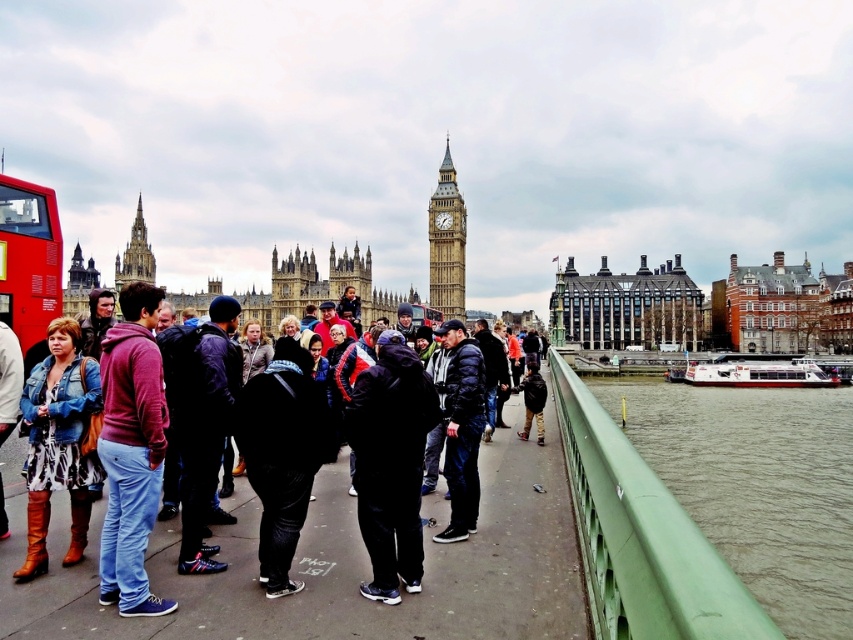
You are standing on Westminster Bridge and want to take a photo of both the point at coordinates point (769,532) and point (6,189). Which point should you focus on first to ensure both are in focus?

You should focus on point (769,532) first because it is closer to the camera than point (6,189), ensuring both points are within the depth of field.

You are standing on Westminster Bridge and want to take a photo of the green rubber railing at lower right. According to the scene description, where should you position yourself to ensure the railing is in the lower right corner of your photo?

The green rubber railing at lower right is located at point (757, 484), so you should position yourself to capture the lower right corner of the photo at that coordinate to include the railing.

You are a tourist standing on Westminster Bridge and want to take a photo of the maroon fleece jacket at center while also capturing the green rubber railing at lower right in the frame. Which direction should you move to ensure both objects are in your camera view?

Move to your left so that the green rubber railing at lower right, which is to the right of the maroon fleece jacket at center, comes into view alongside the jacket.